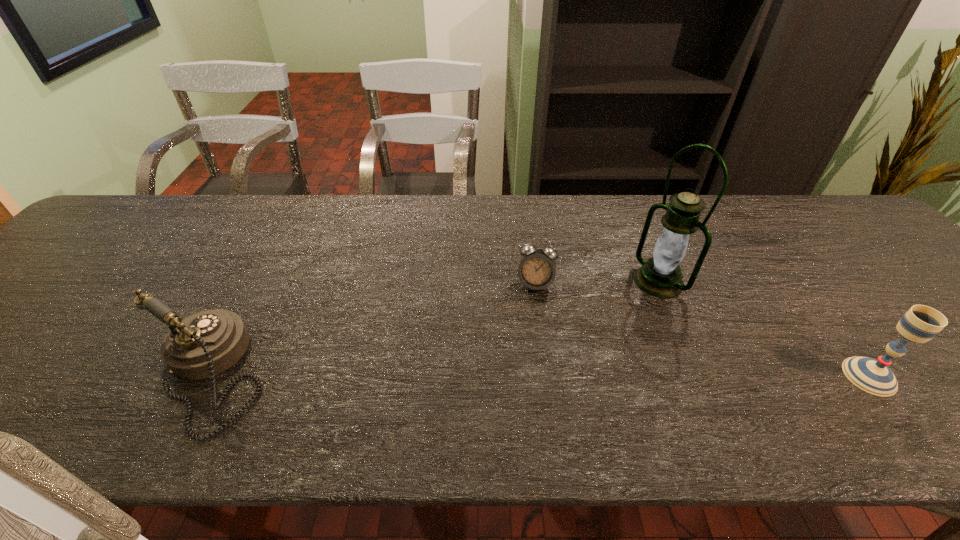
Identify the location of vacant space that's between the leftmost object and the shortest object. (372, 329).

This screenshot has height=540, width=960. I want to click on blank region between the tallest object and the telephone, so click(x=433, y=328).

Choose which object is the third nearest neighbor to the rightmost object. Please provide its 2D coordinates. Your answer should be formatted as a tuple, i.e. [(x, y)], where the tuple contains the x and y coordinates of a point satisfying the conditions above.

[(205, 344)]

You are a GUI agent. You are given a task and a screenshot of the screen. Output one action in this format:
    pyautogui.click(x=<x>, y=<y>)
    Task: Click on the object that is the second closest one to the alarm clock
    
    Given the screenshot: What is the action you would take?
    tap(205, 344)

Find the location of a particular element. free space that satisfies the following two spatial constraints: 1. on the back side of the lantern; 2. on the right side of the shortest object is located at coordinates point(535,281).

You are a GUI agent. You are given a task and a screenshot of the screen. Output one action in this format:
    pyautogui.click(x=<x>, y=<y>)
    Task: Click on the vacant point that satisfies the following two spatial constraints: 1. on the back side of the leftmost object; 2. on the left side of the tallest object
    The width and height of the screenshot is (960, 540).
    Given the screenshot: What is the action you would take?
    pyautogui.click(x=258, y=281)